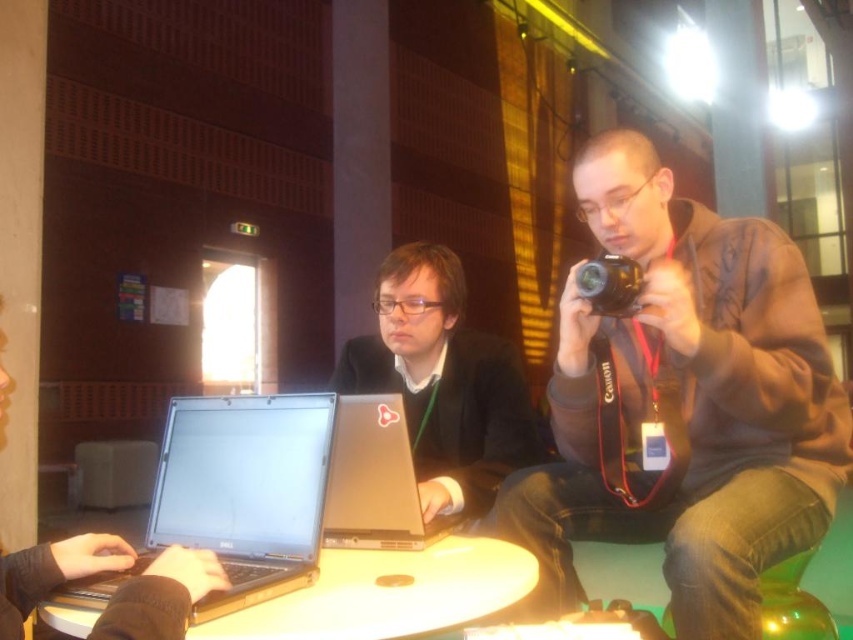
In the scene shown: You are standing in the room and want to locate the matte black laptop at center. According to the coordinates provided, where is it positioned in the image?

The matte black laptop at center is located at the coordinates point (444, 381).

You need to place both the silver metallic laptop at center and the black plastic camera at right into a rectangular box that is 18 inches wide. Can both items fit side by side without overlapping?

The silver metallic laptop at center might be wider than black plastic camera at right. If the laptop is wider, then the total width of both items combined might exceed 18 inches, making it uncertain if they can fit side by side without overlapping. The exact dimensions are needed to confirm.

You are setting up a photography studio in this room. You need to place a tall tripod that requires at least 18 inches of vertical clearance between the table and the ceiling. Given the height of the matte black laptop at center and the white glossy round table at center, can the tripod be safely placed on the table without hitting the ceiling?

The matte black laptop at center is taller than the white glossy round table at center. Since the table itself is the surface, the vertical clearance would depend on the table height plus the laptop height. However, the description only states the laptop is taller than the table, but not their absolute heights. Without knowing the table height or the total clearance, we cannot confirm if the 18 inches requirement is met. More information is needed.